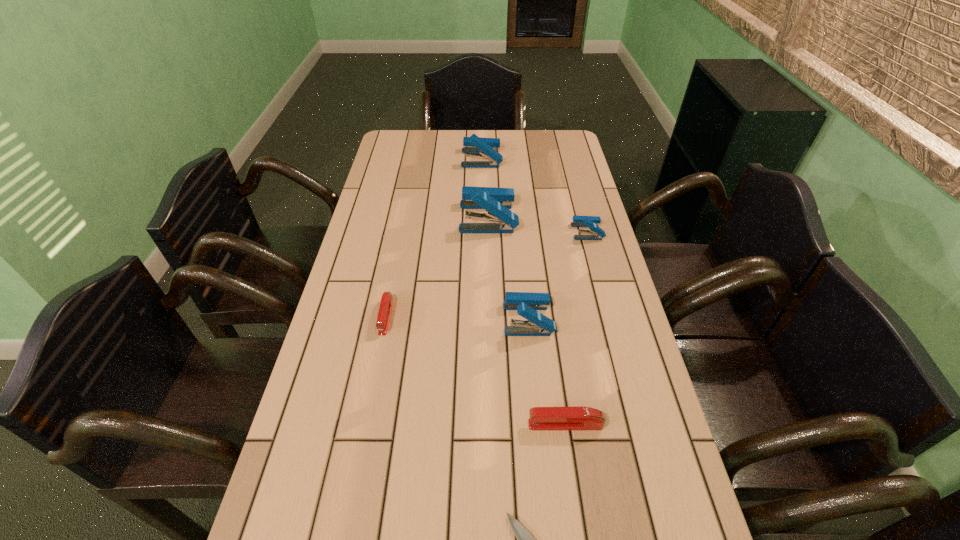
Identify the location of the biggest blue stapler. This screenshot has height=540, width=960. (496, 201).

Find the location of a particular element. The image size is (960, 540). the tallest stapler is located at coordinates (496, 201).

Where is `the farthest object`? The image size is (960, 540). the farthest object is located at coordinates (476, 146).

Locate an element on the screen. The height and width of the screenshot is (540, 960). the second biggest blue stapler is located at coordinates point(476,146).

Image resolution: width=960 pixels, height=540 pixels. Identify the location of the fifth shortest object. (526, 304).

I want to click on the fourth shortest stapler, so click(x=526, y=304).

Locate an element on the screen. The height and width of the screenshot is (540, 960). the smallest blue stapler is located at coordinates (597, 233).

Locate an element on the screen. the fourth shortest object is located at coordinates (597, 233).

Find the location of a particular element. This screenshot has height=540, width=960. the nearer red stapler is located at coordinates (541, 418).

At what (x,y) coordinates should I click in order to perform the action: click on the nearest stapler. Please return your answer as a coordinate pair (x, y). The width and height of the screenshot is (960, 540). Looking at the image, I should click on (541, 418).